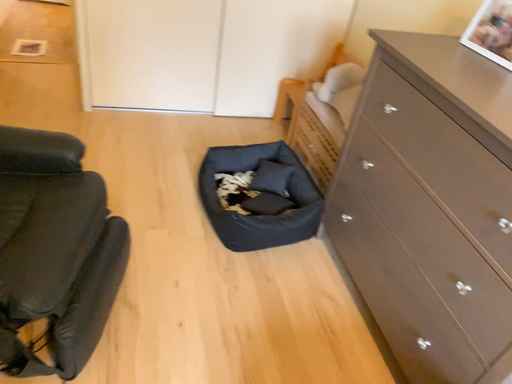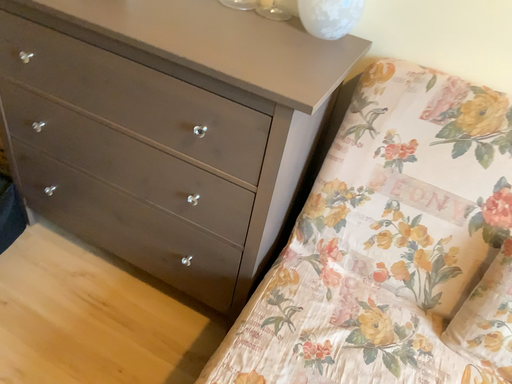
Question: Which way did the camera rotate in the video?

Choices:
 (A) rotated left
 (B) rotated right

Answer: (B)